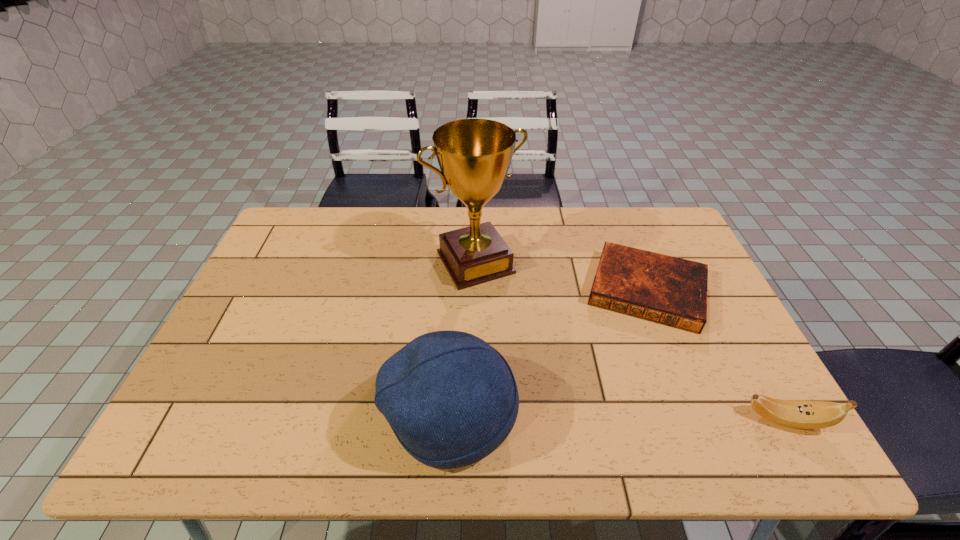
You are a GUI agent. You are given a task and a screenshot of the screen. Output one action in this format:
    pyautogui.click(x=<x>, y=<y>)
    Task: Click on the free space on the desktop that is between the second tallest object and the second shortest object and is positioned on the spine side of the Bible
    This screenshot has width=960, height=540.
    Given the screenshot: What is the action you would take?
    pyautogui.click(x=626, y=417)

You are a GUI agent. You are given a task and a screenshot of the screen. Output one action in this format:
    pyautogui.click(x=<x>, y=<y>)
    Task: Click on the free space on the desktop that is between the skullcap and the banana and is positioned on the plaque of the award
    The image size is (960, 540).
    Given the screenshot: What is the action you would take?
    pyautogui.click(x=569, y=415)